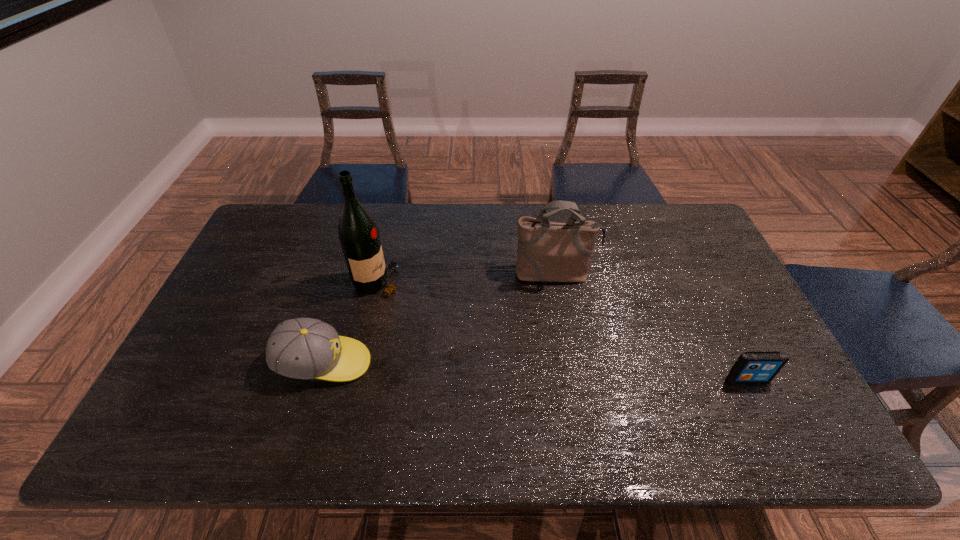
You are a GUI agent. You are given a task and a screenshot of the screen. Output one action in this format:
    pyautogui.click(x=<x>, y=<y>)
    Task: Click on the object at the right edge
    
    Given the screenshot: What is the action you would take?
    pyautogui.click(x=752, y=366)

In the image, there is a desktop. Where is `vacant space at the far edge`? vacant space at the far edge is located at coordinates [461, 240].

You are a GUI agent. You are given a task and a screenshot of the screen. Output one action in this format:
    pyautogui.click(x=<x>, y=<y>)
    Task: Click on the vacant space at the near edge of the desktop
    The height and width of the screenshot is (540, 960).
    Given the screenshot: What is the action you would take?
    pyautogui.click(x=443, y=443)

You are a GUI agent. You are given a task and a screenshot of the screen. Output one action in this format:
    pyautogui.click(x=<x>, y=<y>)
    Task: Click on the free space at the left edge
    
    Given the screenshot: What is the action you would take?
    [x=280, y=274]

Image resolution: width=960 pixels, height=540 pixels. What are the coordinates of `blank space at the right edge of the desktop` in the screenshot? It's located at (711, 290).

In the image, there is a desktop. Where is `free space at the far right corner`? Image resolution: width=960 pixels, height=540 pixels. free space at the far right corner is located at coordinates (658, 220).

In order to click on empty location between the shortest object and the second shortest object in this screenshot , I will do `click(536, 371)`.

This screenshot has width=960, height=540. What are the coordinates of `blank region between the second tallest object and the third tallest object` in the screenshot? It's located at (440, 319).

The height and width of the screenshot is (540, 960). In order to click on vacant area that lies between the third shortest object and the shortest object in this screenshot , I will do `click(651, 327)`.

This screenshot has width=960, height=540. I want to click on free spot between the second shortest object and the shoulder bag, so click(x=440, y=319).